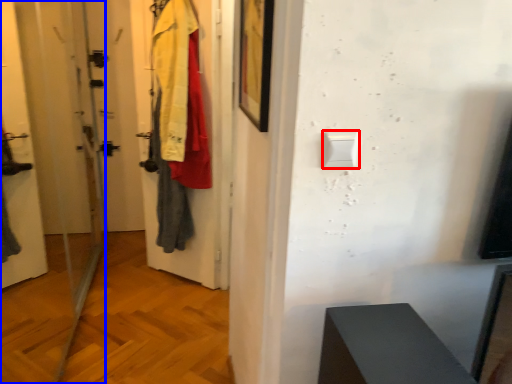
Question: Which object appears closest to the camera in this image, light switch (highlighted by a red box) or screen door (highlighted by a blue box)?

Choices:
 (A) light switch
 (B) screen door

Answer: (B)